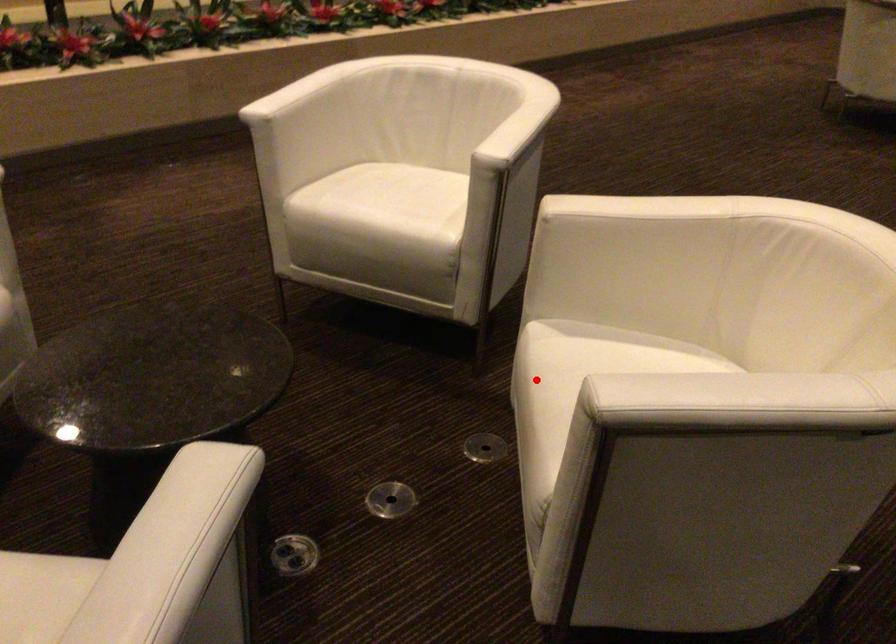
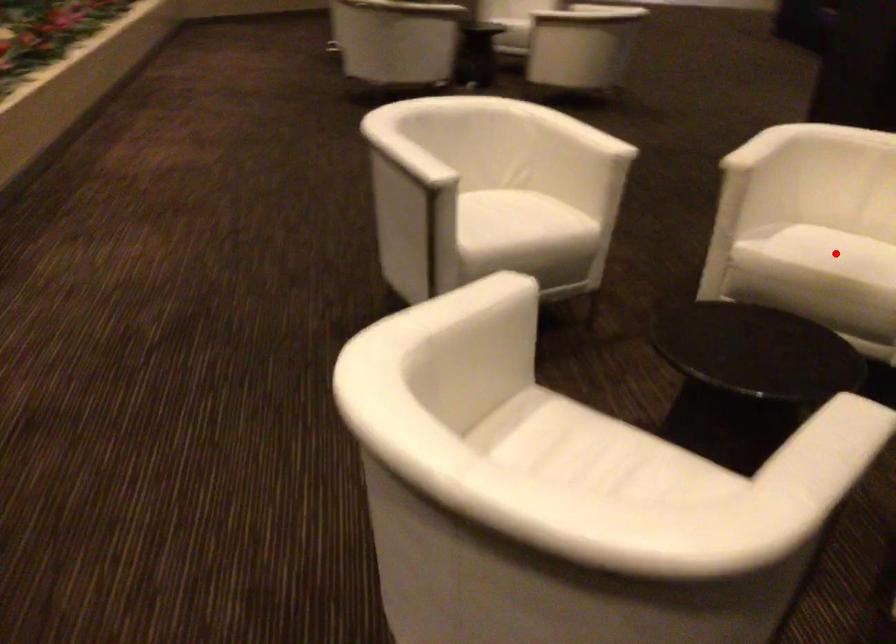
I am providing you with two images of the same scene from different viewpoints. A red point is marked on the first image and another point is marked on the second image. Are the points marked in image1 and image2 representing the same 3D position?

Yes